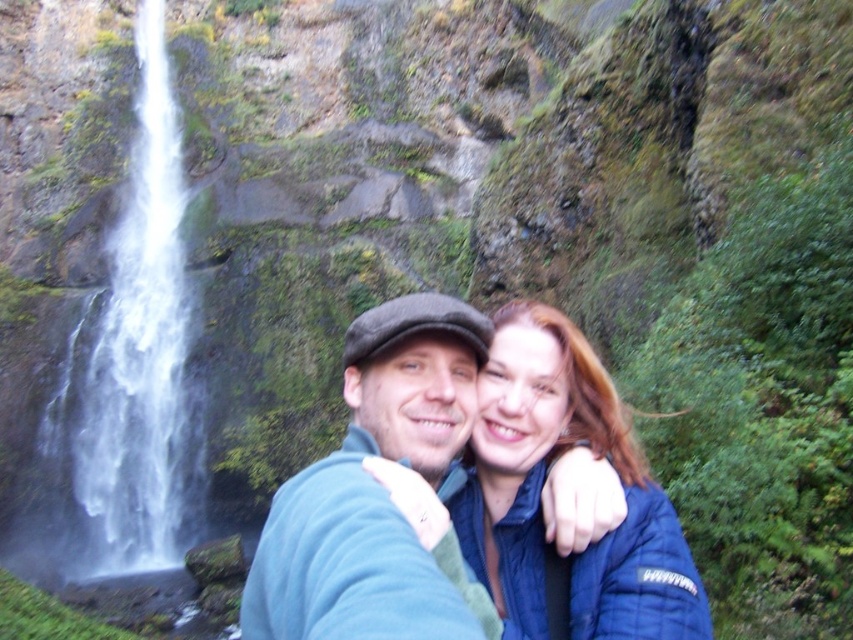
Between blue fleece jacket at center and blue quilted jacket at center, which one is positioned lower?

blue quilted jacket at center is lower down.

Locate an element on the screen. blue fleece jacket at center is located at coordinates (374, 486).

This screenshot has width=853, height=640. What are the coordinates of `blue fleece jacket at center` in the screenshot? It's located at (374, 486).

Does blue fleece jacket at center have a lesser height compared to white frothy water at left?

Yes.

The height and width of the screenshot is (640, 853). What do you see at coordinates (374, 486) in the screenshot?
I see `blue fleece jacket at center` at bounding box center [374, 486].

Is point (401, 545) positioned after point (93, 449)?

No, (401, 545) is in front of (93, 449).

Where is `blue fleece jacket at center`? The width and height of the screenshot is (853, 640). blue fleece jacket at center is located at coordinates (374, 486).

Between blue quilted jacket at center and white frothy water at left, which one is positioned lower?

blue quilted jacket at center

Is point (543, 435) in front of point (103, 408)?

Yes, it is.

Where is `blue quilted jacket at center`? Image resolution: width=853 pixels, height=640 pixels. blue quilted jacket at center is located at coordinates (544, 477).